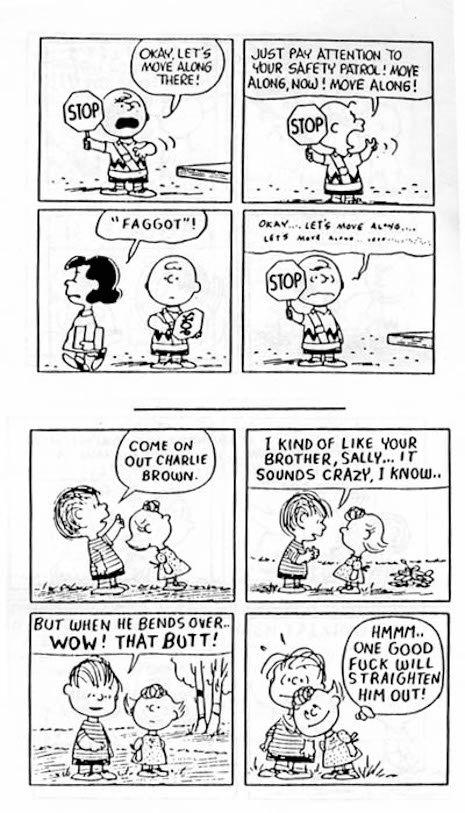
Where is `bottom left corner of panel`? bottom left corner of panel is located at coordinates (245, 781), (31, 781), (31, 601), (245, 601), (243, 371), (38, 370), (39, 198), (243, 202).